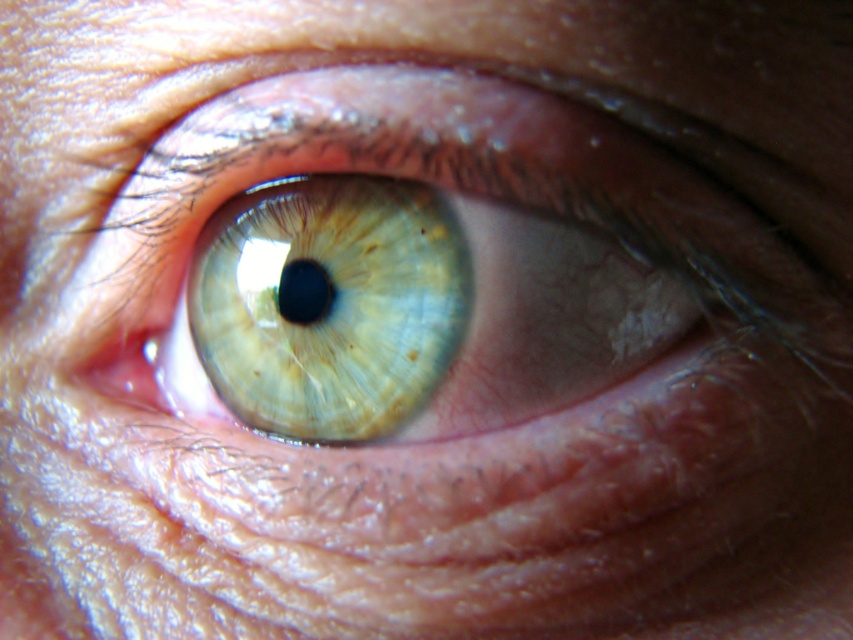
Between green translucent eye at center and translucent yellow-green iris at center, which one is positioned lower?

green translucent eye at center

Looking at this image, is green translucent eye at center to the right of translucent yellow-green iris at center from the viewer's perspective?

Yes, green translucent eye at center is to the right of translucent yellow-green iris at center.

Locate an element on the screen. This screenshot has width=853, height=640. green translucent eye at center is located at coordinates (329, 305).